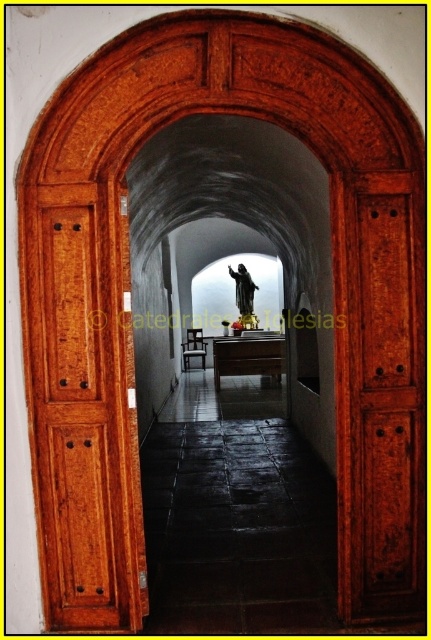
Does wooden panelled door at left appear on the right side of black polished statue at center?

In fact, wooden panelled door at left is to the left of black polished statue at center.

Locate an element on the screen. wooden panelled door at left is located at coordinates 81,403.